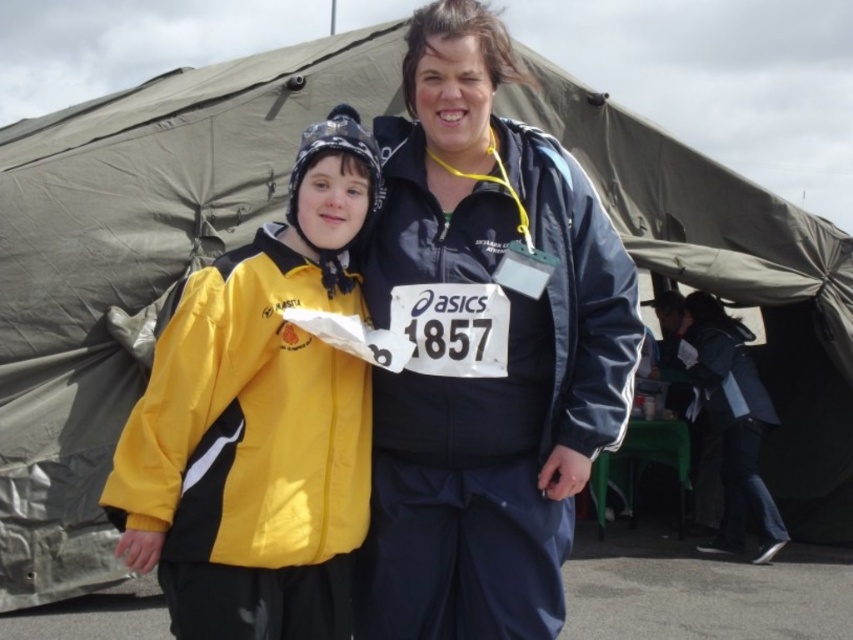
Question: Is matte blue jacket at center positioned in front of yellow matte jacket at center?

Choices:
 (A) no
 (B) yes

Answer: (A)

Question: Which of the following is the closest to the observer?

Choices:
 (A) (534, 544)
 (B) (157, 497)

Answer: (B)

Question: Which point appears farthest from the camera in this image?

Choices:
 (A) (607, 422)
 (B) (201, 492)

Answer: (A)

Question: Can you confirm if matte blue jacket at center is wider than yellow matte jacket at center?

Choices:
 (A) yes
 (B) no

Answer: (A)

Question: Which point appears farthest from the camera in this image?

Choices:
 (A) [x=407, y=540]
 (B) [x=183, y=292]

Answer: (B)

Question: Can you confirm if matte blue jacket at center is positioned below yellow matte jacket at center?

Choices:
 (A) yes
 (B) no

Answer: (B)